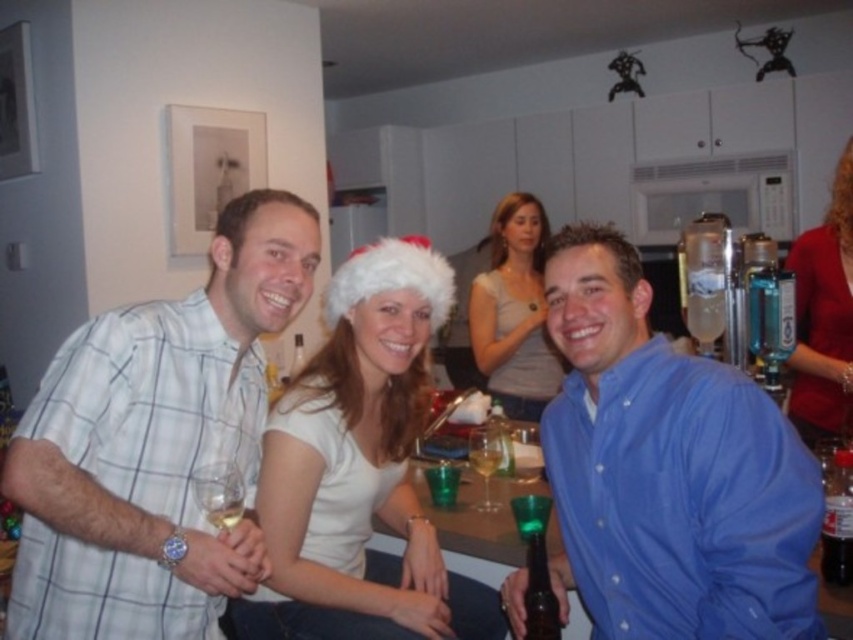
Question: Which point is farther to the camera?

Choices:
 (A) (x=480, y=298)
 (B) (x=221, y=477)
 (C) (x=726, y=547)

Answer: (A)

Question: Does white matte santa hat at center appear on the left side of translucent glass at center?

Choices:
 (A) no
 (B) yes

Answer: (B)

Question: Which of the following is the farthest from the observer?

Choices:
 (A) (843, 404)
 (B) (535, 275)
 (C) (485, 468)

Answer: (B)

Question: Is white matte santa hat at center smaller than clear glass wine glass at center?

Choices:
 (A) yes
 (B) no

Answer: (B)

Question: Which point is closer to the camera?

Choices:
 (A) translucent glass at center
 (B) white checkered shirt at center

Answer: (B)

Question: Can you confirm if blue button-down shirt at center is thinner than clear glass wine glass at center?

Choices:
 (A) yes
 (B) no

Answer: (B)